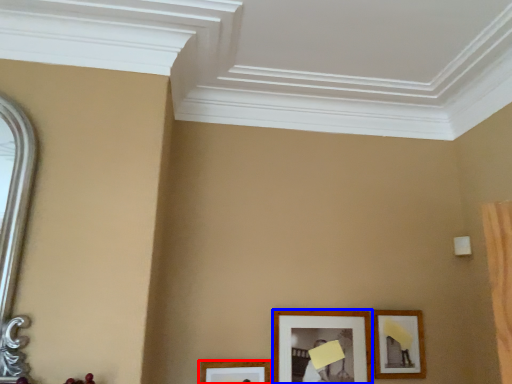
Question: Which point is further to the camera, picture frame (highlighted by a red box) or picture frame (highlighted by a blue box)?

Choices:
 (A) picture frame
 (B) picture frame

Answer: (B)